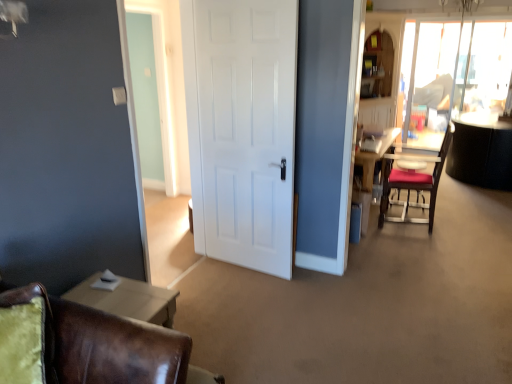
Identify the location of vacant point to the right of white matte door at center. Image resolution: width=512 pixels, height=384 pixels. (309, 286).